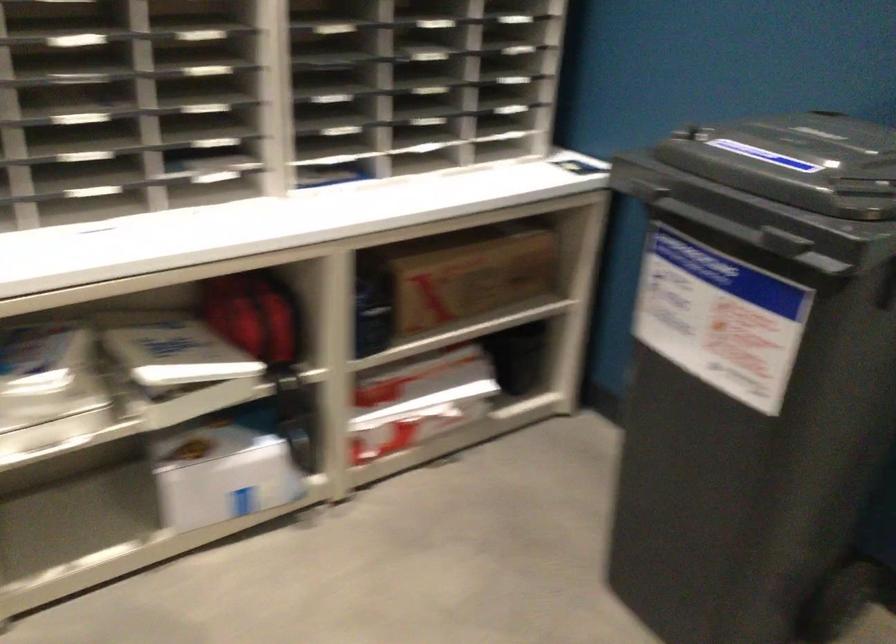
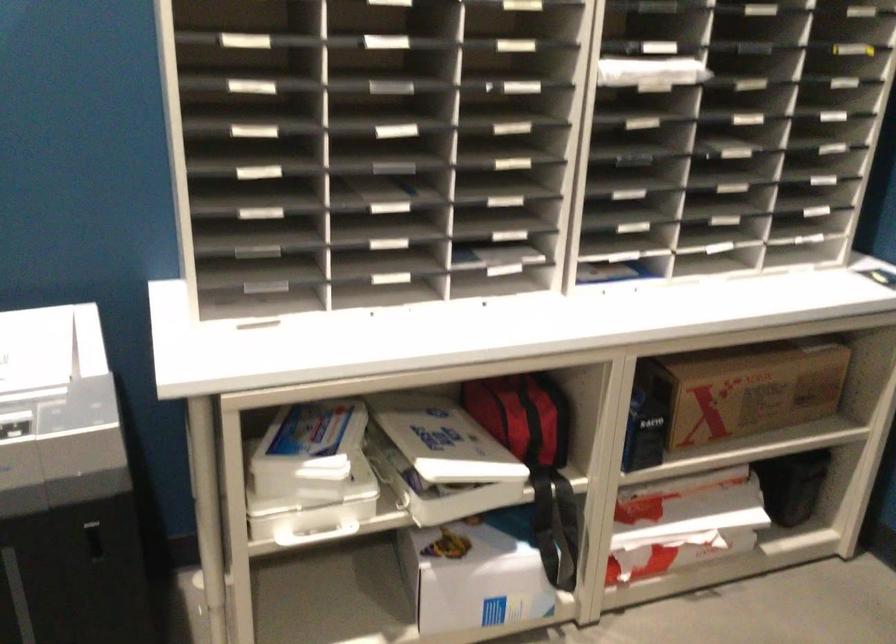
Question: The camera is either moving clockwise (left) or counter-clockwise (right) around the object. The first image is from the beginning of the video and the second image is from the end. Is the camera moving left or right when shooting the video?

Choices:
 (A) Left
 (B) Right

Answer: (B)